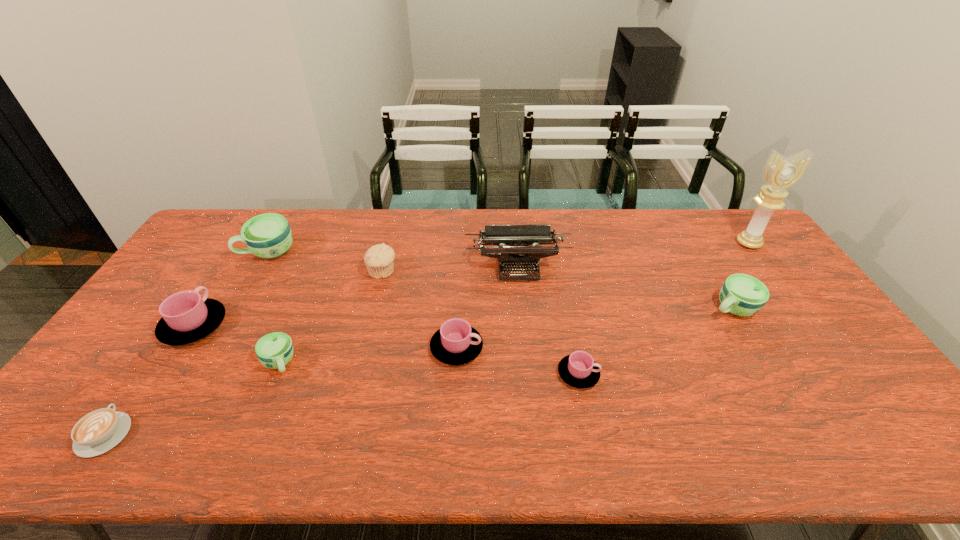
What are the coordinates of `vacant space located 0.070m on the side of the shortest object with the handle` in the screenshot? It's located at coord(137,386).

This screenshot has height=540, width=960. Identify the location of vacant space situated on the side of the shortest object with the handle. (160, 352).

Image resolution: width=960 pixels, height=540 pixels. Find the location of `award at the far edge`. award at the far edge is located at coordinates (780, 174).

This screenshot has width=960, height=540. In order to click on cup that is at the far edge in this screenshot , I will do `click(268, 235)`.

Identify the location of object that is positioned at the near edge. (97, 432).

The width and height of the screenshot is (960, 540). I want to click on cup that is positioned at the left edge, so click(186, 317).

Locate an element on the screen. The height and width of the screenshot is (540, 960). cappuccino present at the left edge is located at coordinates (97, 432).

The height and width of the screenshot is (540, 960). I want to click on object at the right edge, so click(780, 174).

Locate an element on the screen. The image size is (960, 540). object located at the near left corner is located at coordinates (97, 432).

Find the location of a particular element. This screenshot has height=540, width=960. object that is at the far right corner is located at coordinates (780, 174).